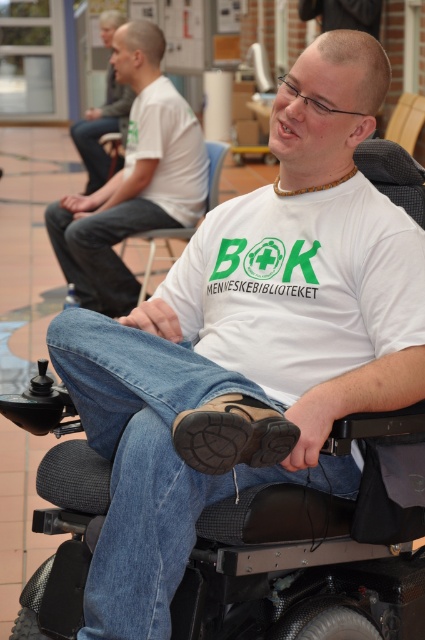
Between matte white wheelchair at center and light brown leather jacket at upper left, which one appears on the right side from the viewer's perspective?

matte white wheelchair at center

Is matte white wheelchair at center shorter than light brown leather jacket at upper left?

No, matte white wheelchair at center is not shorter than light brown leather jacket at upper left.

Between point (187, 176) and point (113, 80), which one is positioned in front?

Point (187, 176) is in front.

You are a GUI agent. You are given a task and a screenshot of the screen. Output one action in this format:
    pyautogui.click(x=<x>, y=<y>)
    Task: Click on the matte white wheelchair at center
    
    Given the screenshot: What is the action you would take?
    pyautogui.click(x=133, y=179)

Who is positioned more to the left, light brown leather jacket at upper left or blue fabric chair at center?

Positioned to the left is light brown leather jacket at upper left.

Does light brown leather jacket at upper left appear under blue fabric chair at center?

No, light brown leather jacket at upper left is not below blue fabric chair at center.

You are a GUI agent. You are given a task and a screenshot of the screen. Output one action in this format:
    pyautogui.click(x=<x>, y=<y>)
    Task: Click on the light brown leather jacket at upper left
    The image size is (425, 640).
    Given the screenshot: What is the action you would take?
    pyautogui.click(x=102, y=131)

Which is below, matte white wheelchair at center or blue fabric chair at center?

Positioned lower is blue fabric chair at center.

Who is more forward, (85, 225) or (215, 202)?

Positioned in front is point (85, 225).

Between point (130, 195) and point (215, 177), which one is positioned in front?

Point (130, 195)

The height and width of the screenshot is (640, 425). What are the coordinates of `matte white wheelchair at center` in the screenshot? It's located at click(133, 179).